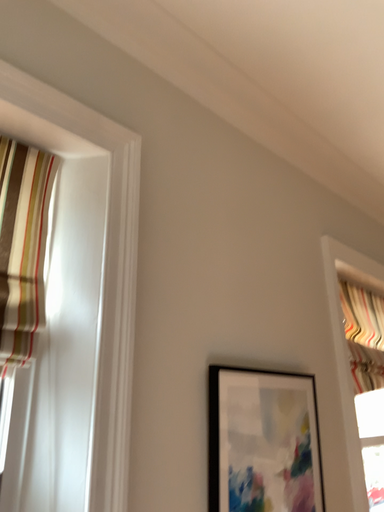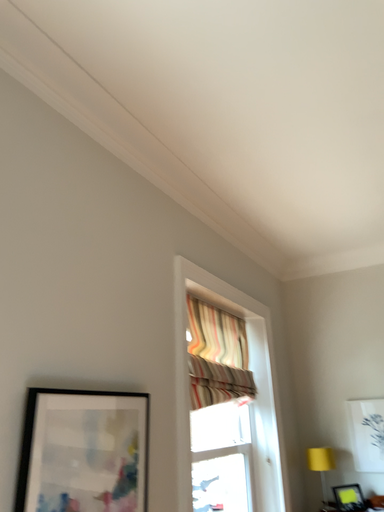
Question: Which way did the camera rotate in the video?

Choices:
 (A) rotated left
 (B) rotated right

Answer: (B)